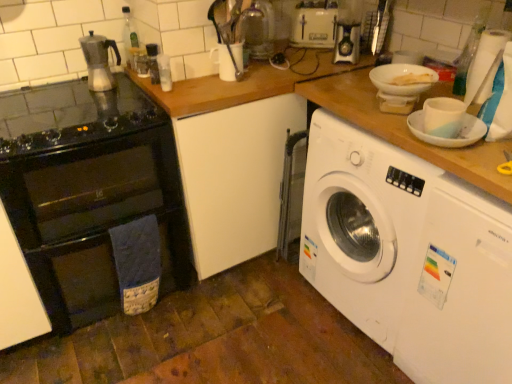
Locate an element on the screen. This screenshot has height=384, width=512. free space in front of white plastic toaster at upper center, placed as the 3th appliance when sorted from front to back is located at coordinates (308, 52).